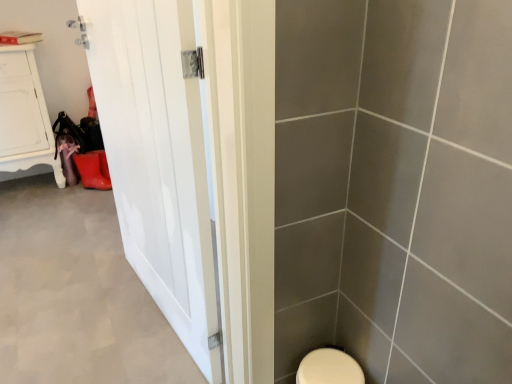
This screenshot has width=512, height=384. What are the coordinates of `free space that is to the left of white glossy door at left` in the screenshot? It's located at (81, 300).